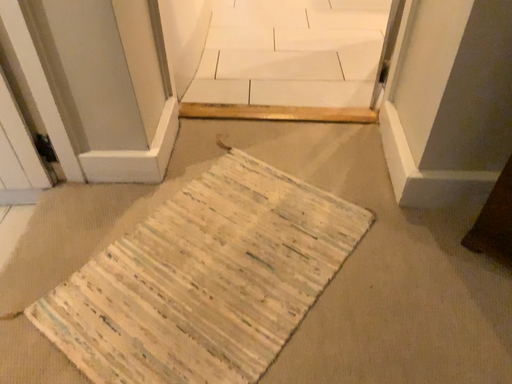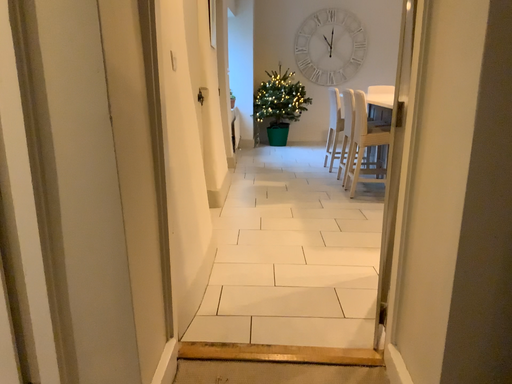
Question: How did the camera likely rotate when shooting the video?

Choices:
 (A) rotated upward
 (B) rotated downward

Answer: (A)